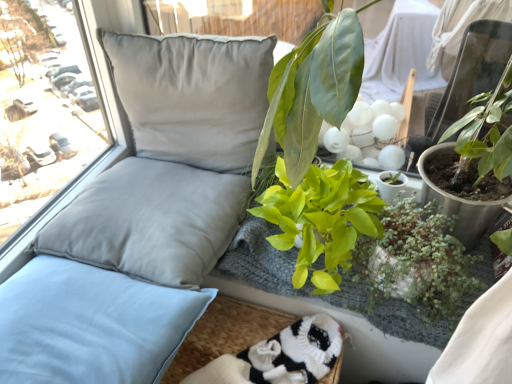
Question: From their relative heights in the image, would you say satin gray pillow at upper left, acting as the 1th pillow starting from the top, is taller or shorter than green leafy plant at upper right, which is counted as the second floral arrangement, starting from the bottom?

Choices:
 (A) short
 (B) tall

Answer: (A)

Question: Relative to green leafy plant at upper right, acting as the 1th floral arrangement starting from the top, is satin gray pillow at upper left, which is the third pillow in bottom-to-top order, in front or behind?

Choices:
 (A) behind
 (B) front

Answer: (A)

Question: Which object is positioned farthest from the green glossy plant at center, which ranks as the 1th houseplant in left-to-right order?

Choices:
 (A) satin gray pillow at upper left, acting as the 1th pillow starting from the top
 (B) green leafy plant at upper right, acting as the 1th floral arrangement starting from the top
 (C) green matte plant at lower right, the 2th houseplant in the left-to-right sequence
 (D) green leafy plant at center, which ranks as the second floral arrangement in top-to-bottom order
 (E) white knitted socks at lower center

Answer: (A)

Question: Estimate the real-world distances between objects in this image. Which object is closer to the green glossy plant at center, which ranks as the 1th houseplant in left-to-right order?

Choices:
 (A) green matte plant at lower right, the 2th houseplant in the left-to-right sequence
 (B) satin gray pillow at upper left, acting as the 1th pillow starting from the top
 (C) green leafy plant at center, which ranks as the second floral arrangement in top-to-bottom order
 (D) satin gray pillow at left, which appears as the second pillow when viewed from the top
 (E) white knitted socks at lower center

Answer: (C)